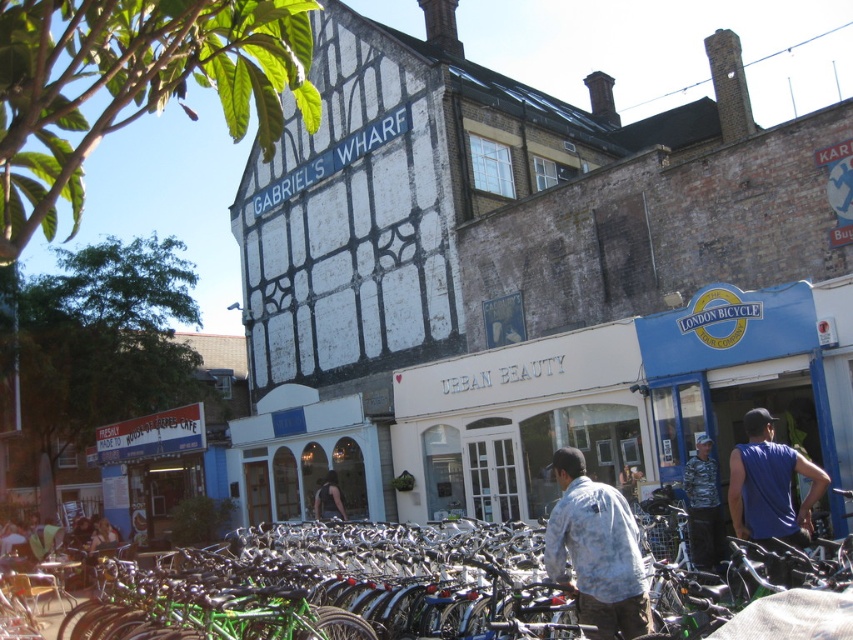
Does shiny metallic bicycle at center appear over light blue faded shirt at center?

No.

Can you confirm if shiny metallic bicycle at center is positioned to the left of light blue faded shirt at center?

Indeed, shiny metallic bicycle at center is positioned on the left side of light blue faded shirt at center.

Does point (434, 529) come behind point (556, 529)?

Yes, point (434, 529) is farther from viewer.

Where is `shiny metallic bicycle at center`? shiny metallic bicycle at center is located at coordinates (335, 588).

Which is below, blue sleeveless shirt at center-right or camouflage jacket at center?

Positioned lower is camouflage jacket at center.

Is blue sleeveless shirt at center-right below camouflage jacket at center?

Actually, blue sleeveless shirt at center-right is above camouflage jacket at center.

Who is more forward, (769,435) or (701,490)?

Point (769,435) is more forward.

Image resolution: width=853 pixels, height=640 pixels. In order to click on blue sleeveless shirt at center-right in this screenshot , I will do `click(769, 486)`.

Is light blue faded shirt at center positioned at the back of dark blue shirt at center?

No, it is not.

Who is more forward, (611, 618) or (318, 486)?

Point (611, 618)

The width and height of the screenshot is (853, 640). Find the location of `light blue faded shirt at center`. light blue faded shirt at center is located at coordinates (596, 550).